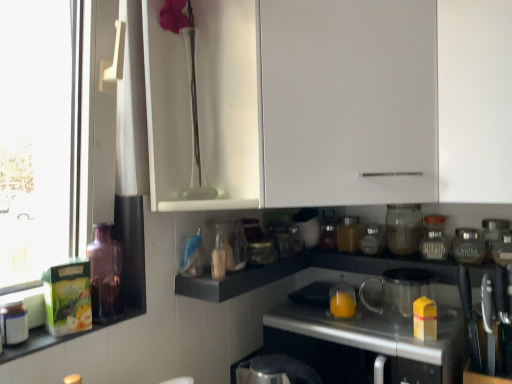
This screenshot has height=384, width=512. Identify the location of transparent glass jar at lower center, the fourth appliance viewed from the left. (403, 228).

Locate an element on the screen. The image size is (512, 384). matte glass jar at left is located at coordinates (59, 337).

Between translucent glass bottle at left, which is counted as the 2th bottle, starting from the front, and metallic silver kettle at lower center, which appears as the first appliance when viewed from the left, which one has more height?

Standing taller between the two is metallic silver kettle at lower center, which appears as the first appliance when viewed from the left.

Considering the sizes of objects translucent glass bottle at left, placed as the 5th bottle when sorted from right to left, and metallic silver kettle at lower center, positioned as the 6th appliance in right-to-left order, in the image provided, who is thinner, translucent glass bottle at left, placed as the 5th bottle when sorted from right to left, or metallic silver kettle at lower center, positioned as the 6th appliance in right-to-left order,?

Thinner between the two is translucent glass bottle at left, placed as the 5th bottle when sorted from right to left.

Could you tell me if translucent glass bottle at left, placed as the 5th bottle when sorted from right to left, is turned towards metallic silver kettle at lower center, which appears as the first appliance when viewed from the left?

No, translucent glass bottle at left, placed as the 5th bottle when sorted from right to left, does not turn towards metallic silver kettle at lower center, which appears as the first appliance when viewed from the left.

Image resolution: width=512 pixels, height=384 pixels. There is a translucent glass bottle at left, which is counted as the 2th bottle, starting from the front. What are the coordinates of `the 2nd appliance below it (from the image's perspective)` in the screenshot? It's located at (276, 371).

Looking at this image, which is correct: translucent glass bottle at left, which is counted as the 2th bottle, starting from the front, is inside metallic silver canister at right, which ranks as the 5th appliance in left-to-right order, or outside of it?

translucent glass bottle at left, which is counted as the 2th bottle, starting from the front, exists outside the volume of metallic silver canister at right, which ranks as the 5th appliance in left-to-right order.

Which of these two, translucent glass bottle at left, placed as the 5th bottle when sorted from right to left, or metallic silver canister at right, which is the 2th appliance in right-to-left order, stands taller?

translucent glass bottle at left, placed as the 5th bottle when sorted from right to left.

From the image's perspective, which object appears higher, translucent glass bottle at left, which is the second bottle in left-to-right order, or metallic silver canister at right, which ranks as the 5th appliance in left-to-right order?

metallic silver canister at right, which ranks as the 5th appliance in left-to-right order, appears higher in the image.

Looking at this image, between translucent glass bottle at left, placed as the 5th bottle when sorted from right to left, and metallic silver canister at right, which is the 2th appliance in right-to-left order, which one has smaller width?

translucent glass bottle at left, placed as the 5th bottle when sorted from right to left, is thinner.

Based on the photo, considering the relative positions of metallic silver canisters at lower right, placed as the first appliance when sorted from right to left, and metallic silver kettle at lower center, positioned as the 6th appliance in right-to-left order, in the image provided, is metallic silver canisters at lower right, placed as the first appliance when sorted from right to left, to the left or to the right of metallic silver kettle at lower center, positioned as the 6th appliance in right-to-left order,?

Based on their positions, metallic silver canisters at lower right, placed as the first appliance when sorted from right to left, is located to the right of metallic silver kettle at lower center, positioned as the 6th appliance in right-to-left order.

Is metallic silver canisters at lower right, placed as the first appliance when sorted from right to left, in contact with metallic silver kettle at lower center, which appears as the first appliance when viewed from the left?

metallic silver canisters at lower right, placed as the first appliance when sorted from right to left, is not next to metallic silver kettle at lower center, which appears as the first appliance when viewed from the left, and they're not touching.

Which object is thinner, metallic silver canisters at lower right, acting as the sixth appliance starting from the left, or metallic silver kettle at lower center, which appears as the first appliance when viewed from the left?

With smaller width is metallic silver canisters at lower right, acting as the sixth appliance starting from the left.

Is metallic silver canisters at lower right, placed as the first appliance when sorted from right to left, facing towards metallic silver kettle at lower center, positioned as the 6th appliance in right-to-left order?

No.

Is metallic silver kettle at lower center, positioned as the 6th appliance in right-to-left order, facing towards metallic silver countertop at center?

No, metallic silver kettle at lower center, positioned as the 6th appliance in right-to-left order, is not facing towards metallic silver countertop at center.

Is point (308, 381) closer to viewer compared to point (436, 359)?

That is True.

From the image's perspective, is metallic silver kettle at lower center, positioned as the 6th appliance in right-to-left order, under metallic silver countertop at center?

Indeed, from the image's perspective, metallic silver kettle at lower center, positioned as the 6th appliance in right-to-left order, is shown beneath metallic silver countertop at center.

Considering the sizes of objects metallic silver kettle at lower center, positioned as the 6th appliance in right-to-left order, and metallic silver countertop at center in the image provided, who is smaller, metallic silver kettle at lower center, positioned as the 6th appliance in right-to-left order, or metallic silver countertop at center?

Smaller between the two is metallic silver kettle at lower center, positioned as the 6th appliance in right-to-left order.

Is white glossy jar at lower left, acting as the 1th bottle starting from the left, in contact with matte glass jar at center-right, which is the 5th bottle from left to right?

No, white glossy jar at lower left, acting as the 1th bottle starting from the left, is not beside matte glass jar at center-right, which is the 5th bottle from left to right.

The image size is (512, 384). Find the location of `the 3rd bottle positioned above the white glossy jar at lower left, placed as the sixth bottle when sorted from back to front (from the image's perspective)`. the 3rd bottle positioned above the white glossy jar at lower left, placed as the sixth bottle when sorted from back to front (from the image's perspective) is located at coordinates (372, 240).

Looking at this image, from the image's perspective, is white glossy jar at lower left, acting as the 1th bottle starting from the left, located above or below matte glass jar at center-right, which appears as the second bottle when viewed from the right?

Based on their image positions, white glossy jar at lower left, acting as the 1th bottle starting from the left, is located beneath matte glass jar at center-right, which appears as the second bottle when viewed from the right.

Looking at this image, are translucent glass blender at lower center, the fourth appliance viewed from the right, and white matte cabinet at upper center, the first cabinetry from the back, making contact?

translucent glass blender at lower center, the fourth appliance viewed from the right, and white matte cabinet at upper center, the first cabinetry from the back, are not in contact.

Looking at this image, is translucent glass blender at lower center, the fourth appliance viewed from the right, wider or thinner than white matte cabinet at upper center, the first cabinetry from the back?

Clearly, translucent glass blender at lower center, the fourth appliance viewed from the right, has less width compared to white matte cabinet at upper center, the first cabinetry from the back.

Measure the distance between translucent glass blender at lower center, the fourth appliance viewed from the right, and white matte cabinet at upper center, the first cabinetry from the back.

translucent glass blender at lower center, the fourth appliance viewed from the right, and white matte cabinet at upper center, the first cabinetry from the back, are 54.16 centimeters apart from each other.

Is point (407, 292) more distant than point (355, 132)?

Yes, point (407, 292) is behind point (355, 132).

Considering the positions of objects matte glass jar at center-right, which is the 5th bottle from left to right, and metallic silver canisters at lower right, acting as the sixth appliance starting from the left, in the image provided, who is behind, matte glass jar at center-right, which is the 5th bottle from left to right, or metallic silver canisters at lower right, acting as the sixth appliance starting from the left,?

matte glass jar at center-right, which is the 5th bottle from left to right.

In terms of width, does matte glass jar at center-right, positioned as the fourth bottle in front-to-back order, look wider or thinner when compared to metallic silver canisters at lower right, placed as the first appliance when sorted from right to left?

In the image, matte glass jar at center-right, positioned as the fourth bottle in front-to-back order, appears to be more narrow than metallic silver canisters at lower right, placed as the first appliance when sorted from right to left.

From a real-world perspective, which object stands above the other?

In real-world perspective, metallic silver canisters at lower right, placed as the first appliance when sorted from right to left, is above.

From a real-world perspective, which bottle is the 3rd one underneath the metallic silver canisters at lower right, placed as the first appliance when sorted from right to left? Please provide its 2D coordinates.

[(372, 240)]

The width and height of the screenshot is (512, 384). In order to click on the 2nd bottle positioned above the metallic silver kettle at lower center, positioned as the 6th appliance in right-to-left order (from the image's perspective) in this screenshot , I will do point(105,274).

The width and height of the screenshot is (512, 384). I want to click on the 5th bottle to the left of the metallic silver canister at right, which ranks as the 5th appliance in left-to-right order, counting from the anchor's position, so click(105, 274).

When comparing their distances from matte glass jar at center-right, which is the 5th bottle from left to right, does matte glass jar at left or translucent glass jar at center, marked as the third bottle in a left-to-right arrangement, seem closer?

translucent glass jar at center, marked as the third bottle in a left-to-right arrangement, is closer to matte glass jar at center-right, which is the 5th bottle from left to right.

Considering their positions, is translucent glass blender at lower center, placed as the 3th appliance when sorted from left to right, positioned further to metallic silver canister at right, which ranks as the 5th appliance in left-to-right order, than clear glass jar at right, the 1th bottle when ordered from right to left?

Based on the image, translucent glass blender at lower center, placed as the 3th appliance when sorted from left to right, appears to be further to metallic silver canister at right, which ranks as the 5th appliance in left-to-right order.

Estimate the real-world distances between objects in this image. Which object is further from white glossy jar at lower left, which ranks as the first bottle in front-to-back order, transparent glass vase at upper center, which is the 1th cabinetry in front-to-back order, or matte glass jar at center-right, which appears as the second bottle when viewed from the right?

matte glass jar at center-right, which appears as the second bottle when viewed from the right, lies further to white glossy jar at lower left, which ranks as the first bottle in front-to-back order, than the other object.

When comparing their distances from transparent glass jar at lower center, the third appliance when ordered from right to left, does white glossy jar at lower left, placed as the sixth bottle when sorted from back to front, or matte glass jar at center-right, which appears as the second bottle when viewed from the right, seem closer?

Among the two, matte glass jar at center-right, which appears as the second bottle when viewed from the right, is located nearer to transparent glass jar at lower center, the third appliance when ordered from right to left.

Estimate the real-world distances between objects in this image. Which object is closer to white matte cabinet at upper center, which ranks as the second cabinetry in front-to-back order, metallic silver canisters at lower right, placed as the first appliance when sorted from right to left, or translucent glass jar at center, which is the 3th bottle in right-to-left order?

translucent glass jar at center, which is the 3th bottle in right-to-left order.

From the image, which object appears to be farther from matte glass jar at left, white glossy jar at center, the 5th appliance viewed from the right, or metallic silver canisters at lower right, placed as the first appliance when sorted from right to left?

The object further to matte glass jar at left is metallic silver canisters at lower right, placed as the first appliance when sorted from right to left.

Which object lies further to the anchor point white matte cabinet at upper center, the first cabinetry from the back, metallic silver kettle at lower center, which appears as the first appliance when viewed from the left, or white glossy jar at lower left, the sixth bottle viewed from the right?

white glossy jar at lower left, the sixth bottle viewed from the right, is further to white matte cabinet at upper center, the first cabinetry from the back.

When comparing their distances from matte glass jar at left, does translucent glass bottle at left, which is the 5th bottle from back to front, or transparent glass vase at upper center, acting as the second cabinetry starting from the back, seem closer?

Based on the image, translucent glass bottle at left, which is the 5th bottle from back to front, appears to be nearer to matte glass jar at left.

The height and width of the screenshot is (384, 512). I want to click on countertop between translucent glass bottle at left, which is counted as the 2th bottle, starting from the front, and metallic silver canister at right, which is the 2th appliance in right-to-left order, so click(377, 331).

Locate an element on the screen. The image size is (512, 384). appliance situated between transparent glass jar at lower center, the third appliance when ordered from right to left, and metallic silver canisters at lower right, acting as the sixth appliance starting from the left, from left to right is located at coordinates (468, 246).

You are a GUI agent. You are given a task and a screenshot of the screen. Output one action in this format:
    pyautogui.click(x=<x>, y=<y>)
    Task: Click on the shelf between white matte cabinet at upper center, the first cabinetry from the back, and matte glass jar at left in the up-down direction
    This screenshot has height=384, width=512.
    Given the screenshot: What is the action you would take?
    pyautogui.click(x=241, y=279)

You are a GUI agent. You are given a task and a screenshot of the screen. Output one action in this format:
    pyautogui.click(x=<x>, y=<y>)
    Task: Click on the countertop situated between matte glass jar at left and translucent glass blender at lower center, the fourth appliance viewed from the right, from left to right
    
    Given the screenshot: What is the action you would take?
    pyautogui.click(x=377, y=331)